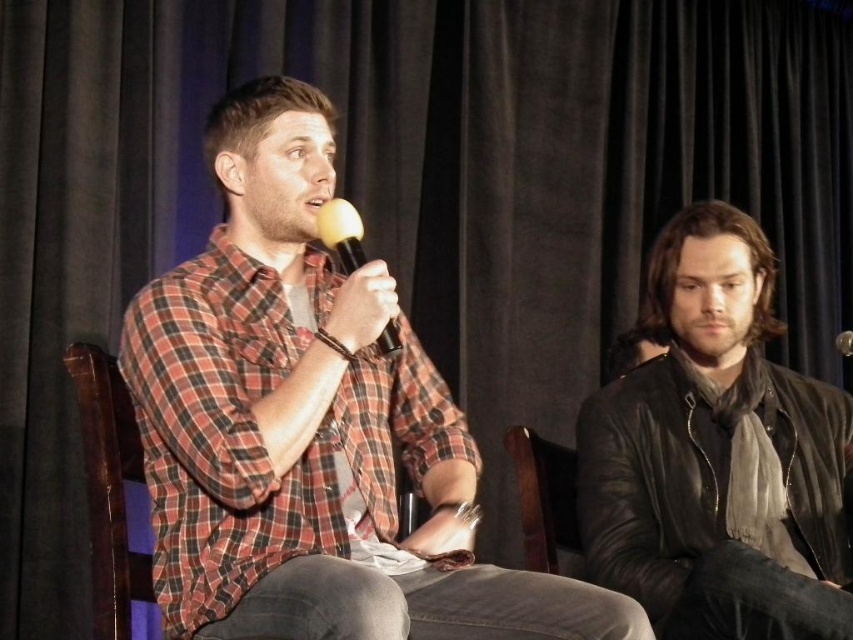
Is plaid shirt at center thinner than brown leather chair at center?

Incorrect, plaid shirt at center's width is not less than brown leather chair at center's.

Between point (294, 150) and point (550, 490), which one is positioned behind?

The point (550, 490) is behind.

Identify the location of plaid shirt at center. This screenshot has height=640, width=853. (310, 426).

Which is below, leather jacket at right or yellow matte microphone at center?

leather jacket at right is below.

Is leather jacket at right positioned in front of yellow matte microphone at center?

No, leather jacket at right is behind yellow matte microphone at center.

Identify the location of leather jacket at right. The height and width of the screenshot is (640, 853). (718, 456).

Locate an element on the screen. leather jacket at right is located at coordinates (718, 456).

Is leather jacket at right positioned in front of brown leather chair at center?

Yes, it is.

Locate an element on the screen. This screenshot has width=853, height=640. leather jacket at right is located at coordinates (718, 456).